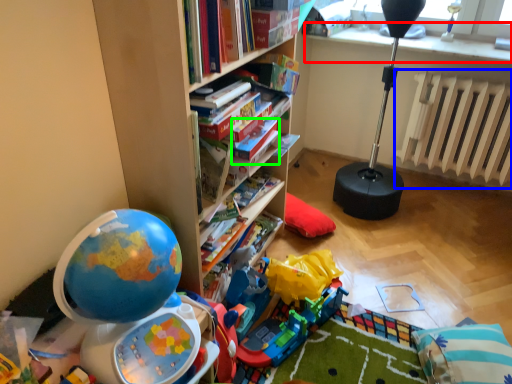
Question: Which object is the closest to the window sill (highlighted by a red box)? Choose among these: radiator (highlighted by a blue box) or paperback book (highlighted by a green box).

Choices:
 (A) radiator
 (B) paperback book

Answer: (A)